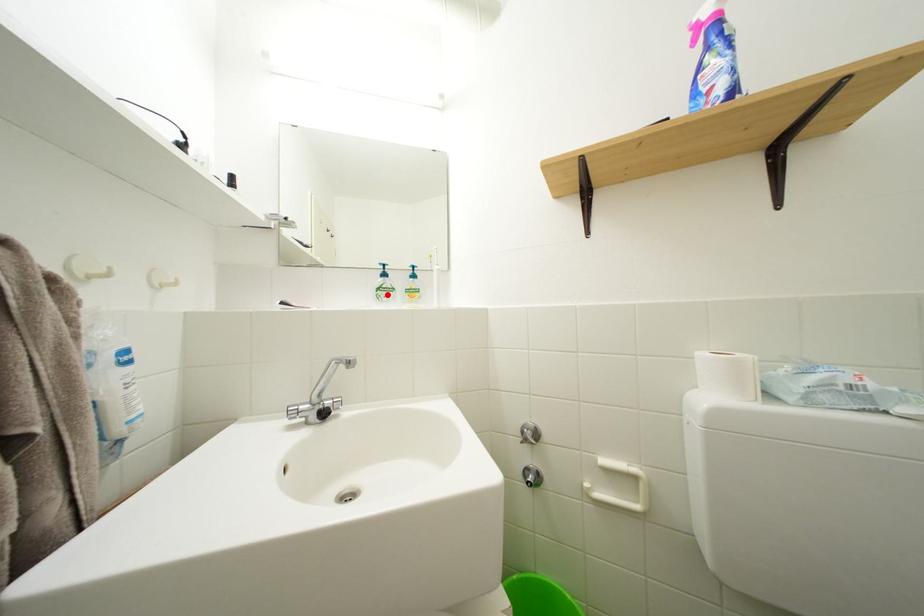
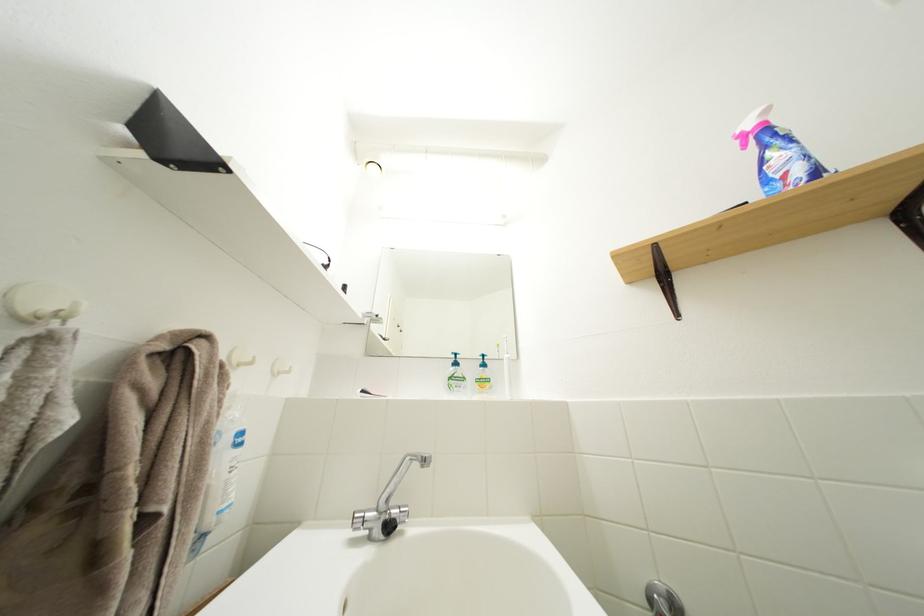
Where in the second image is the point corresponding to the highlighted location from the first image?

(458, 384)